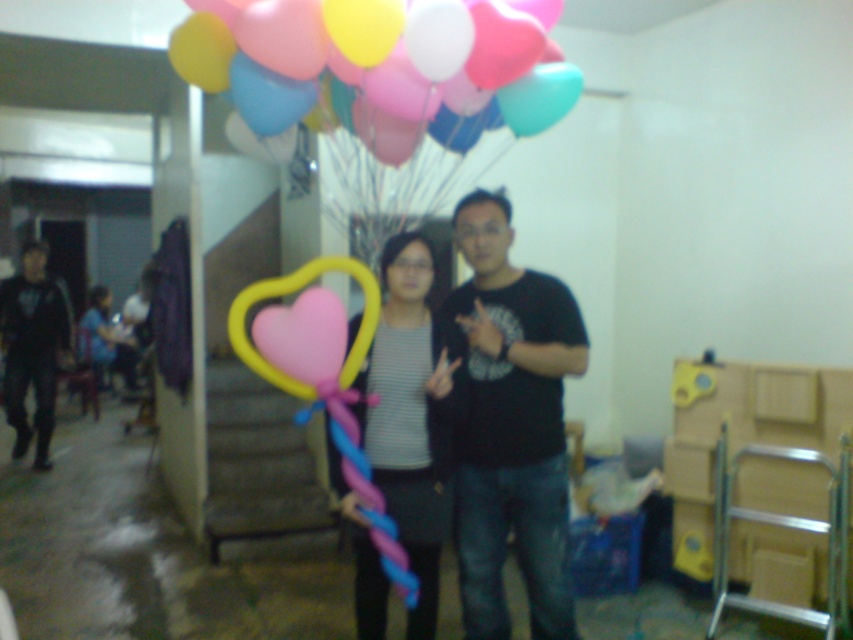
Question: Considering the real-world distances, which object is farthest from the black matte t-shirt at center?

Choices:
 (A) striped fabric shirt at center
 (B) black matte pants at left

Answer: (B)

Question: Can you confirm if matte balloons at upper center is positioned above striped fabric shirt at center?

Choices:
 (A) no
 (B) yes

Answer: (B)

Question: Which point is farther from the camera taking this photo?

Choices:
 (A) (61, 296)
 (B) (399, 436)

Answer: (A)

Question: Can you confirm if matte balloons at upper center is positioned to the left of striped fabric shirt at center?

Choices:
 (A) no
 (B) yes

Answer: (A)

Question: Which is nearer to the matte balloons at upper center?

Choices:
 (A) striped fabric shirt at center
 (B) black matte t-shirt at center
 (C) black matte pants at left

Answer: (A)

Question: Does striped fabric shirt at center appear over black matte pants at left?

Choices:
 (A) no
 (B) yes

Answer: (A)